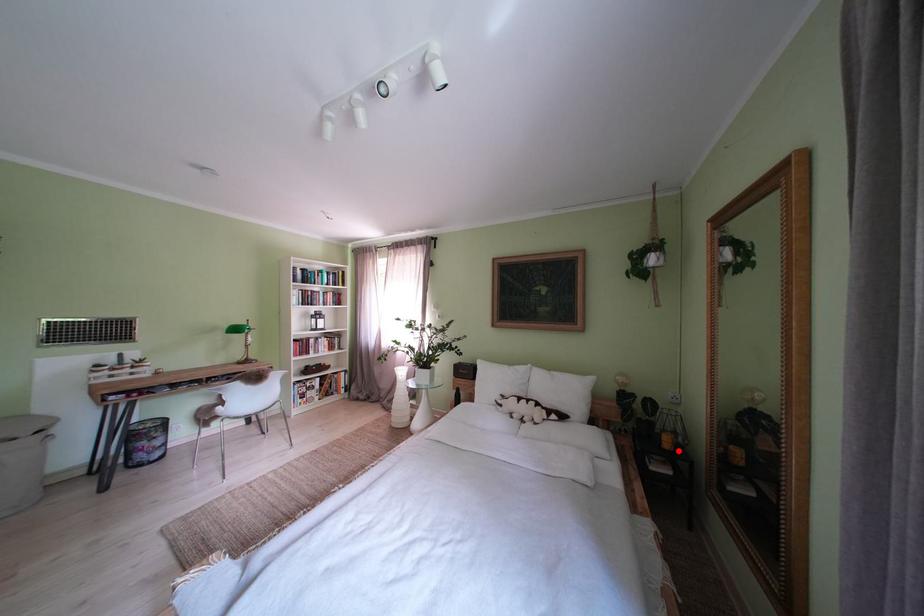
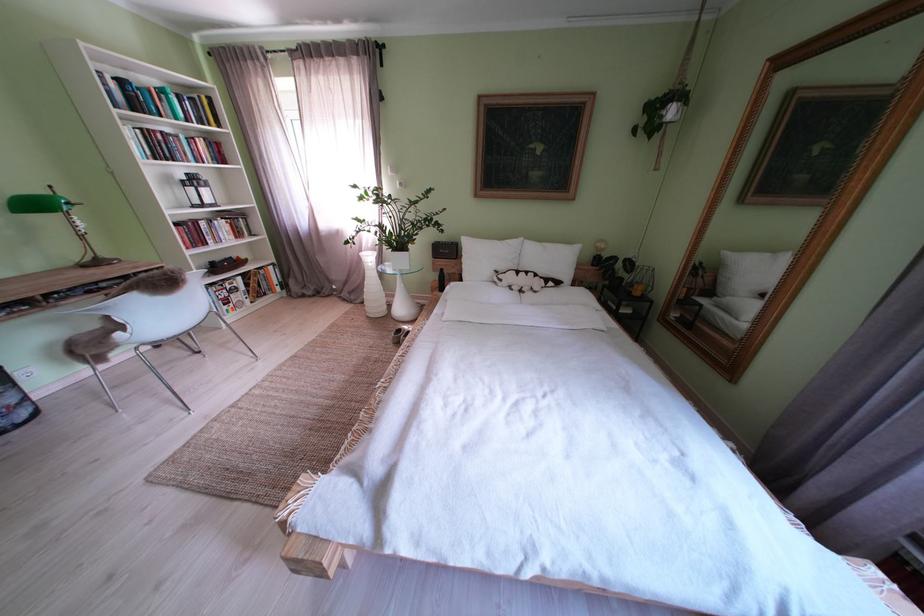
In the second image, find the point that corresponds to the highlighted location in the first image.

(648, 299)